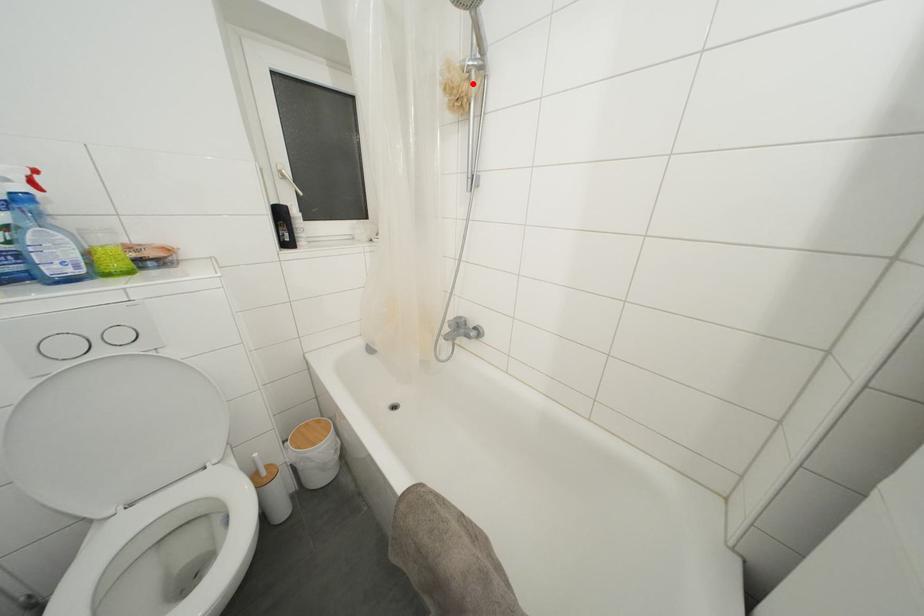
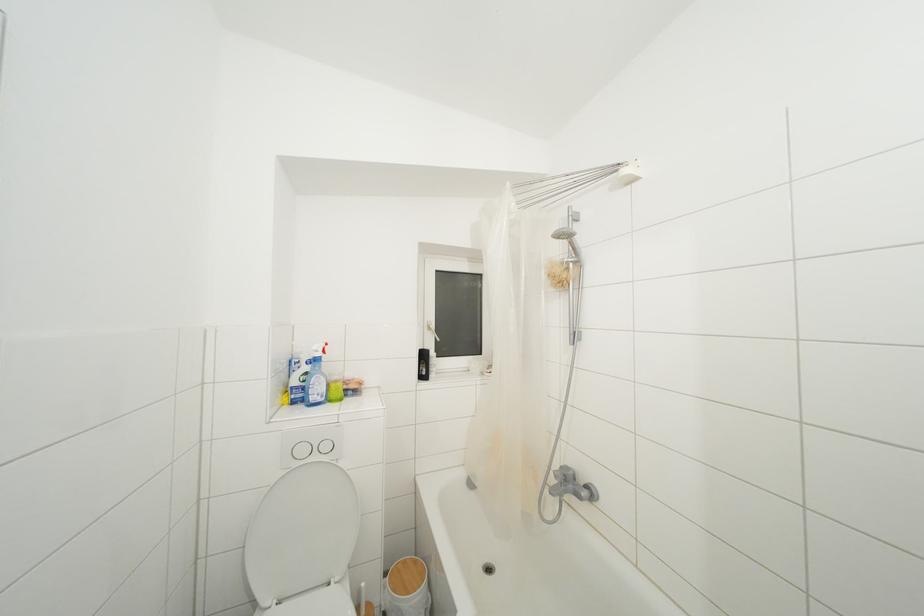
In the second image, find the point that corresponds to the highlighted location in the first image.

(572, 273)